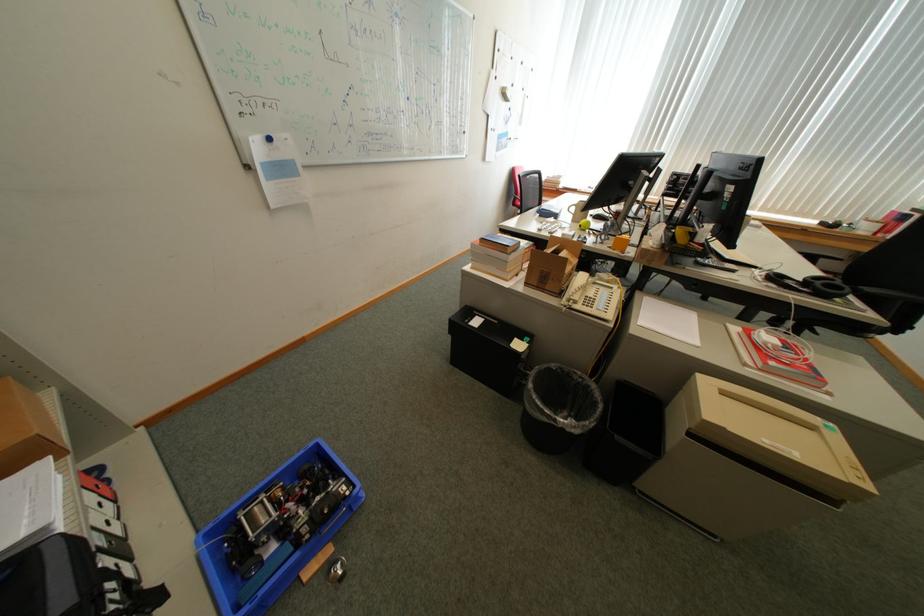
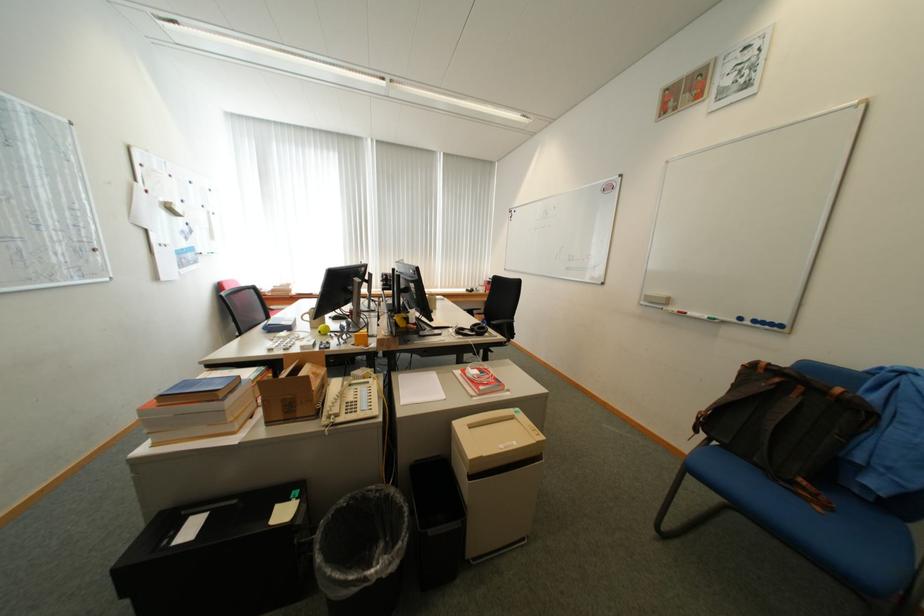
Question: The first image is from the beginning of the video and the second image is from the end. How did the camera likely rotate when shooting the video?

Choices:
 (A) Left
 (B) Right
 (C) Up
 (D) Down

Answer: (B)